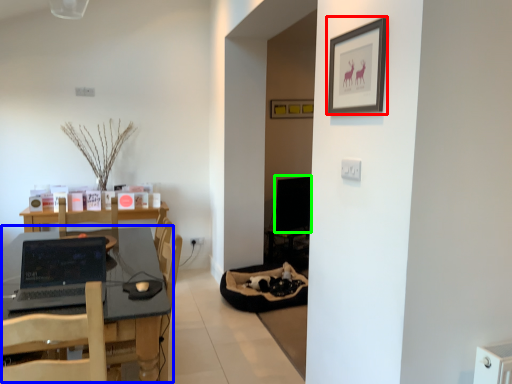
Question: Which object is positioned closest to picture frame (highlighted by a red box)? Select from table (highlighted by a blue box) and computer monitor (highlighted by a green box).

Choices:
 (A) table
 (B) computer monitor

Answer: (A)